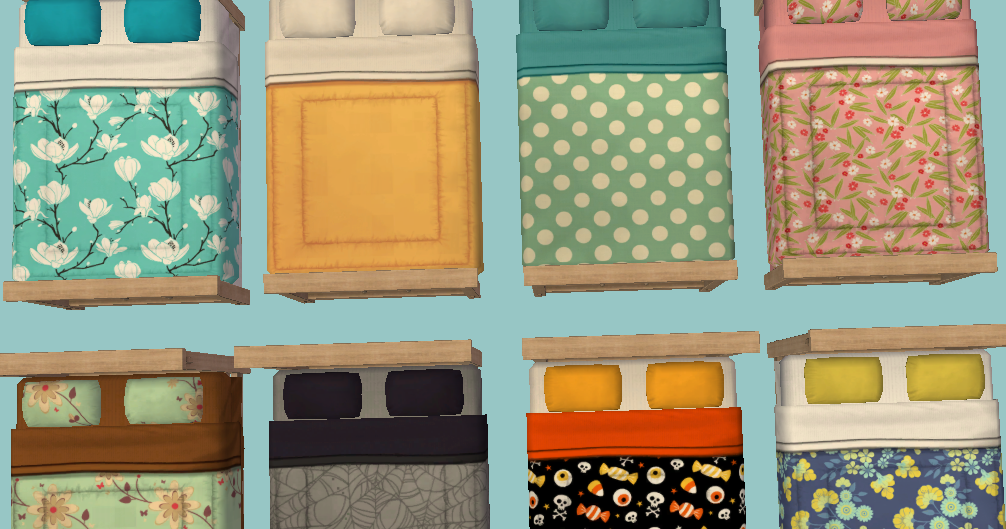
Find the location of a particular element. The image size is (1006, 529). polka dot comforter is located at coordinates (624, 160).